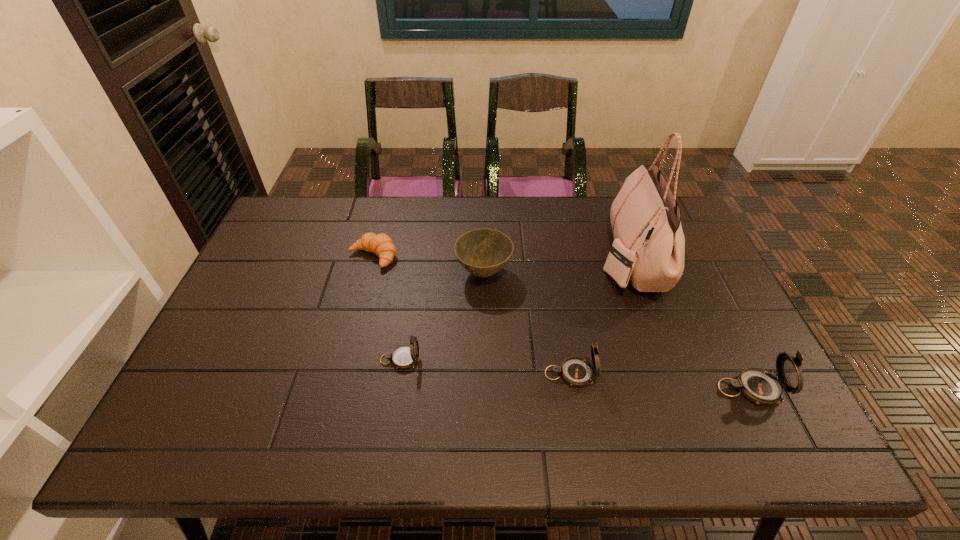
I want to click on unoccupied position between the bowl and the tallest object, so click(557, 265).

The height and width of the screenshot is (540, 960). I want to click on empty space that is in between the second tallest compass and the shortest compass, so click(486, 367).

Where is `vacant space in between the second tallest compass and the tallest compass`? This screenshot has height=540, width=960. vacant space in between the second tallest compass and the tallest compass is located at coordinates (660, 381).

Image resolution: width=960 pixels, height=540 pixels. In order to click on unoccupied area between the tallest compass and the second tallest compass in this screenshot , I will do `click(660, 381)`.

Identify which object is located as the third nearest to the tallest compass. Please provide its 2D coordinates. Your answer should be formatted as a tuple, i.e. [(x, y)], where the tuple contains the x and y coordinates of a point satisfying the conditions above.

[(483, 252)]

Identify which object is located as the nearest to the second shortest compass. Please provide its 2D coordinates. Your answer should be formatted as a tuple, i.e. [(x, y)], where the tuple contains the x and y coordinates of a point satisfying the conditions above.

[(649, 245)]

The height and width of the screenshot is (540, 960). I want to click on the third closest compass relative to the leftmost object, so click(758, 385).

At what (x,y) coordinates should I click in order to perform the action: click on compass identified as the closest to the second tallest object. Please return your answer as a coordinate pair (x, y). This screenshot has width=960, height=540. Looking at the image, I should click on (576, 371).

Where is `vacant space that satisfies the following two spatial constraints: 1. on the front side of the bowl; 2. on the face of the shortest compass`? vacant space that satisfies the following two spatial constraints: 1. on the front side of the bowl; 2. on the face of the shortest compass is located at coordinates (485, 360).

You are a GUI agent. You are given a task and a screenshot of the screen. Output one action in this format:
    pyautogui.click(x=<x>, y=<y>)
    Task: Click on the free space that satisfies the following two spatial constraints: 1. on the side of the tallest object with the attached pouch; 2. on the front side of the bowl
    
    Given the screenshot: What is the action you would take?
    pyautogui.click(x=636, y=272)